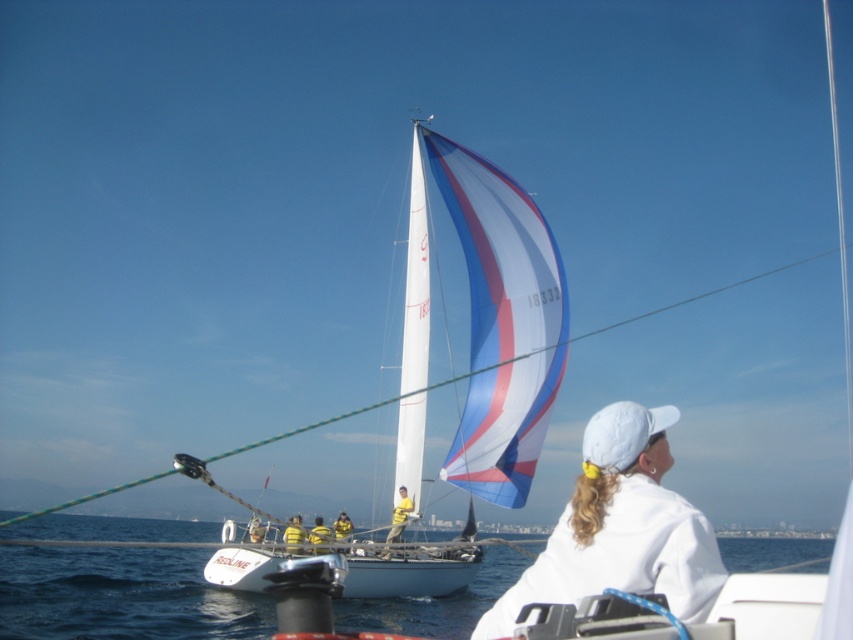
You are a photographer trying to capture the white matte baseball cap at upper center and the blue water at lower center in a single shot. Based on their positions, which object will appear larger in the photo?

The blue water at lower center will appear larger in the photo because it is much taller than the white matte baseball cap at upper center.